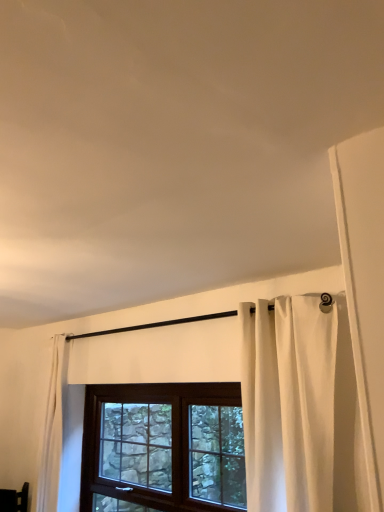
What is the approximate height of brown wooden window at center?

brown wooden window at center is 38.06 inches tall.

Image resolution: width=384 pixels, height=512 pixels. In order to click on brown wooden window at center in this screenshot , I will do `click(163, 447)`.

What do you see at coordinates (163, 447) in the screenshot?
I see `brown wooden window at center` at bounding box center [163, 447].

Where is `white fabric curtain at center`? This screenshot has width=384, height=512. white fabric curtain at center is located at coordinates (289, 403).

The width and height of the screenshot is (384, 512). Describe the element at coordinates (289, 403) in the screenshot. I see `white fabric curtain at center` at that location.

Where is `brown wooden window at center`? Image resolution: width=384 pixels, height=512 pixels. brown wooden window at center is located at coordinates (163, 447).

Which object is positioned more to the left, white fabric curtain at center or brown wooden window at center?

Positioned to the left is brown wooden window at center.

Which object is more forward, white fabric curtain at center or brown wooden window at center?

white fabric curtain at center.

Considering the points (286, 375) and (223, 439), which point is in front, point (286, 375) or point (223, 439)?

The point (286, 375) is more forward.

From the image's perspective, is white fabric curtain at center located above or below brown wooden window at center?

From the image's perspective, white fabric curtain at center appears above brown wooden window at center.

From a real-world perspective, is white fabric curtain at center physically located above or below brown wooden window at center?

In terms of real-world spatial position, white fabric curtain at center is above brown wooden window at center.

Does white fabric curtain at center have a lesser width compared to brown wooden window at center?

Incorrect, the width of white fabric curtain at center is not less than that of brown wooden window at center.

From their relative heights in the image, would you say white fabric curtain at center is taller or shorter than brown wooden window at center?

Considering their sizes, white fabric curtain at center has more height than brown wooden window at center.

From the picture: Considering the sizes of objects white fabric curtain at center and brown wooden window at center in the image provided, who is bigger, white fabric curtain at center or brown wooden window at center?

With larger size is brown wooden window at center.

Is white fabric curtain at center situated inside brown wooden window at center or outside?

white fabric curtain at center is spatially situated outside brown wooden window at center.

Is white fabric curtain at center far away from brown wooden window at center?

Actually, white fabric curtain at center and brown wooden window at center are a little close together.

Is white fabric curtain at center oriented towards brown wooden window at center?

No.

In the scene shown: How many degrees apart are the facing directions of white fabric curtain at center and brown wooden window at center?

They differ by 0.0745 degrees in their facing directions.

How far apart are white fabric curtain at center and brown wooden window at center?

The distance of white fabric curtain at center from brown wooden window at center is 38.73 inches.

Locate an element on the screen. This screenshot has height=512, width=384. curtain that is above the brown wooden window at center (from the image's perspective) is located at coordinates (289, 403).

Does brown wooden window at center appear on the right side of white fabric curtain at center?

No, brown wooden window at center is not to the right of white fabric curtain at center.

Which object is further away from the camera, brown wooden window at center or white fabric curtain at center?

brown wooden window at center is behind.

Which is in front, point (101, 466) or point (319, 479)?

The point (319, 479) is closer.

From the image's perspective, between brown wooden window at center and white fabric curtain at center, who is located below?

brown wooden window at center appears lower in the image.

From a real-world perspective, who is located higher, brown wooden window at center or white fabric curtain at center?

white fabric curtain at center.

Considering the sizes of objects brown wooden window at center and white fabric curtain at center in the image provided, who is thinner, brown wooden window at center or white fabric curtain at center?

brown wooden window at center is thinner.

Who is taller, brown wooden window at center or white fabric curtain at center?

Standing taller between the two is white fabric curtain at center.

Looking at the image, does brown wooden window at center seem bigger or smaller compared to white fabric curtain at center?

brown wooden window at center is bigger than white fabric curtain at center.

Can we say brown wooden window at center lies outside white fabric curtain at center?

Yes, brown wooden window at center is located beyond the bounds of white fabric curtain at center.

Are brown wooden window at center and white fabric curtain at center far apart?

No, brown wooden window at center is not far from white fabric curtain at center.

Looking at this image, is brown wooden window at center oriented away from white fabric curtain at center?

brown wooden window at center does not have its back to white fabric curtain at center.

In order to click on curtain that is above the brown wooden window at center (from a real-world perspective) in this screenshot , I will do `click(289, 403)`.

Find the location of a particular element. Image resolution: width=384 pixels, height=512 pixels. curtain lying above the brown wooden window at center (from the image's perspective) is located at coordinates (289, 403).

Find the location of a particular element. window below the white fabric curtain at center (from a real-world perspective) is located at coordinates (163, 447).